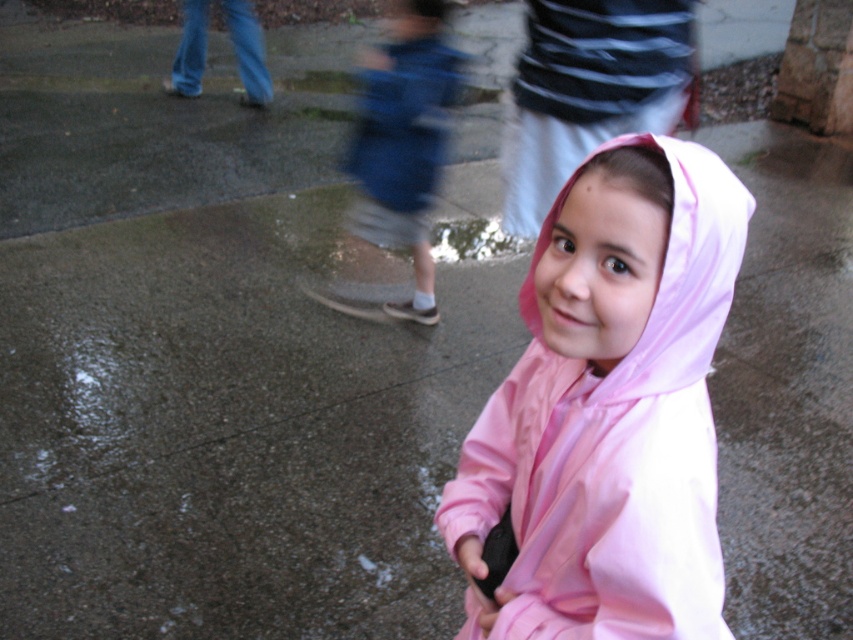
Question: Which object is closer to the camera taking this photo?

Choices:
 (A) blue denim shorts at center
 (B) pink matte raincoat at center

Answer: (B)

Question: Does pink matte raincoat at center have a lesser width compared to blue denim shorts at center?

Choices:
 (A) yes
 (B) no

Answer: (A)

Question: Can you confirm if pink matte raincoat at center is bigger than blue denim shorts at center?

Choices:
 (A) no
 (B) yes

Answer: (A)

Question: Which point is farther from the camera taking this photo?

Choices:
 (A) (567, 566)
 (B) (434, 35)

Answer: (B)

Question: Is pink matte raincoat at center behind blue denim shorts at center?

Choices:
 (A) no
 (B) yes

Answer: (A)